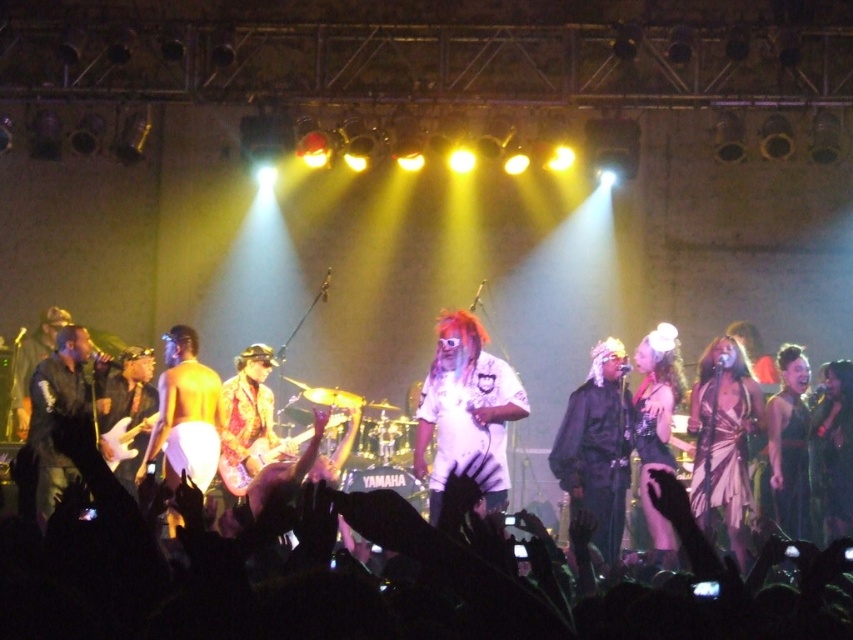
You are a photographer at the concert. You want to capture a photo that includes both the silky purple dress at center right and the black satin dress at right. Considering their sizes, which dress should you focus on to ensure both are visible in the frame?

Since the silky purple dress at center right is larger than the black satin dress at right, you should focus on the silky purple dress at center right to ensure both are visible in the frame.

You are a photographer at the concert and want to capture a shot where the white matte shirt at center and the shiny metallic guitar at center are both visible. Based on their positions, which object should be placed on the left side of the photo?

The shiny metallic guitar at center should be placed on the left side of the photo because the white matte shirt at center is to the right of it.